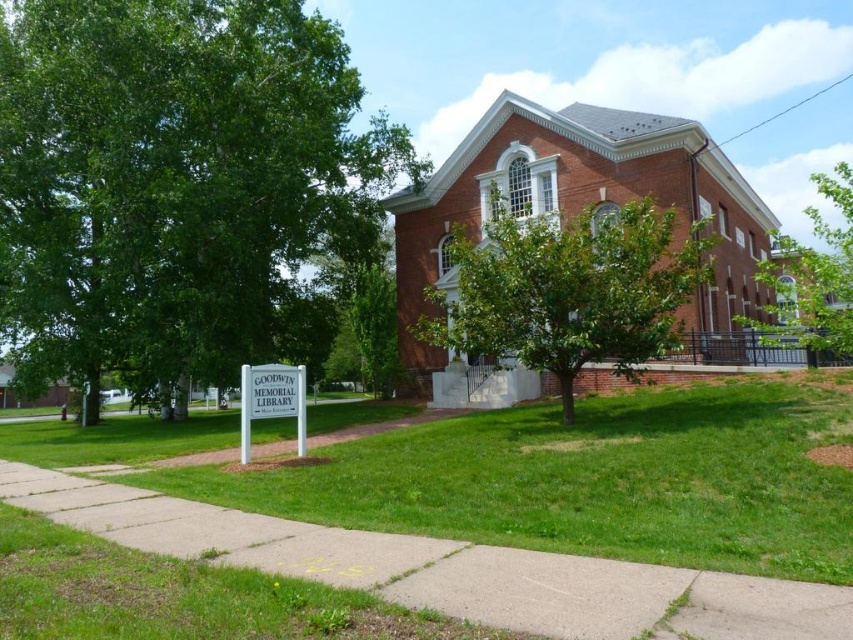
Does green leafy tree at upper right appear on the left side of white plastic sign at lower left?

In fact, green leafy tree at upper right is to the right of white plastic sign at lower left.

Looking at this image, is green leafy tree at upper right to the right of white plastic sign at lower left from the viewer's perspective?

Yes, green leafy tree at upper right is to the right of white plastic sign at lower left.

The image size is (853, 640). What do you see at coordinates (813, 276) in the screenshot?
I see `green leafy tree at upper right` at bounding box center [813, 276].

I want to click on green leafy tree at upper right, so click(813, 276).

Is green leafy tree at center positioned in front of green leafy tree at upper right?

No, green leafy tree at center is behind green leafy tree at upper right.

Is point (465, 291) positioned before point (824, 307)?

No, (465, 291) is behind (824, 307).

You are a GUI agent. You are given a task and a screenshot of the screen. Output one action in this format:
    pyautogui.click(x=<x>, y=<y>)
    Task: Click on the green leafy tree at center
    The width and height of the screenshot is (853, 640).
    Given the screenshot: What is the action you would take?
    tap(569, 289)

Is brick church at center above green leafy tree at upper right?

Incorrect, brick church at center is not positioned above green leafy tree at upper right.

Identify the location of brick church at center. (577, 204).